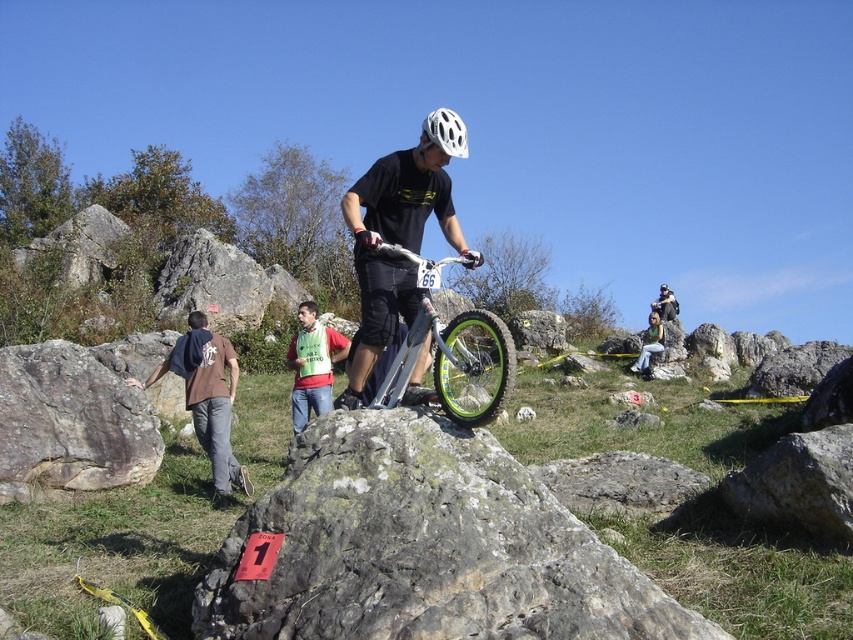
Who is more forward, (30, 404) or (846, 429)?

Point (846, 429)

Find the location of a particular element. The height and width of the screenshot is (640, 853). gray rough rock at left is located at coordinates (70, 422).

Does white matte bicycle helmet at center have a greater width compared to matte black helmet at upper center?

No.

Who is lower down, white matte bicycle helmet at center or matte black helmet at upper center?

matte black helmet at upper center

At what (x,y) coordinates should I click in order to perform the action: click on white matte bicycle helmet at center. Please return your answer as a coordinate pair (x, y). Looking at the image, I should click on (445, 131).

Is matte black bicycle at center smaller than green fabric shirt at center?

Incorrect, matte black bicycle at center is not smaller in size than green fabric shirt at center.

Who is higher up, matte black bicycle at center or green fabric shirt at center?

Positioned higher is matte black bicycle at center.

Where is `matte black bicycle at center`? This screenshot has height=640, width=853. matte black bicycle at center is located at coordinates (398, 236).